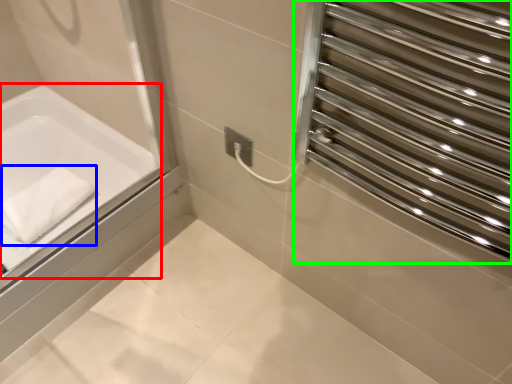
Question: Estimate the real-world distances between objects in this image. Which object is farther from bathtub (highlighted by a red box), bath towel (highlighted by a blue box) or screen door (highlighted by a green box)?

Choices:
 (A) bath towel
 (B) screen door

Answer: (B)